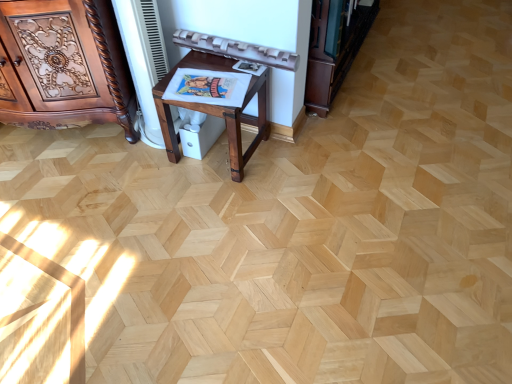
Question: Is dark brown wood bookshelf at upper right at the left side of mahogany wood table at center?

Choices:
 (A) no
 (B) yes

Answer: (A)

Question: Is mahogany wood table at center at the back of dark brown wood bookshelf at upper right?

Choices:
 (A) no
 (B) yes

Answer: (A)

Question: Considering the relative sizes of dark brown wood bookshelf at upper right and mahogany wood table at center in the image provided, is dark brown wood bookshelf at upper right bigger than mahogany wood table at center?

Choices:
 (A) no
 (B) yes

Answer: (B)

Question: From the image's perspective, is dark brown wood bookshelf at upper right located beneath mahogany wood table at center?

Choices:
 (A) yes
 (B) no

Answer: (B)

Question: Does dark brown wood bookshelf at upper right have a lesser height compared to mahogany wood table at center?

Choices:
 (A) no
 (B) yes

Answer: (A)

Question: Is dark brown wood bookshelf at upper right completely or partially outside of mahogany wood table at center?

Choices:
 (A) yes
 (B) no

Answer: (A)

Question: Is the depth of polished wood cabinet at left greater than that of dark brown wood bookshelf at upper right?

Choices:
 (A) no
 (B) yes

Answer: (A)

Question: Considering the relative sizes of polished wood cabinet at left and dark brown wood bookshelf at upper right in the image provided, is polished wood cabinet at left bigger than dark brown wood bookshelf at upper right?

Choices:
 (A) yes
 (B) no

Answer: (A)

Question: Are polished wood cabinet at left and dark brown wood bookshelf at upper right beside each other?

Choices:
 (A) yes
 (B) no

Answer: (B)

Question: Considering the relative sizes of polished wood cabinet at left and dark brown wood bookshelf at upper right in the image provided, is polished wood cabinet at left smaller than dark brown wood bookshelf at upper right?

Choices:
 (A) no
 (B) yes

Answer: (A)

Question: Would you say polished wood cabinet at left is outside dark brown wood bookshelf at upper right?

Choices:
 (A) yes
 (B) no

Answer: (A)

Question: Is polished wood cabinet at left wider than dark brown wood bookshelf at upper right?

Choices:
 (A) yes
 (B) no

Answer: (A)

Question: From a real-world perspective, is polished wood cabinet at left physically below mahogany wood table at center?

Choices:
 (A) yes
 (B) no

Answer: (B)